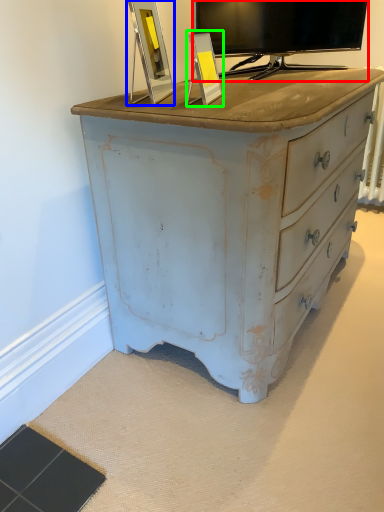
Question: Which is farther away from television (highlighted by a red box)? picture frame (highlighted by a blue box) or picture frame (highlighted by a green box)?

Choices:
 (A) picture frame
 (B) picture frame

Answer: (B)